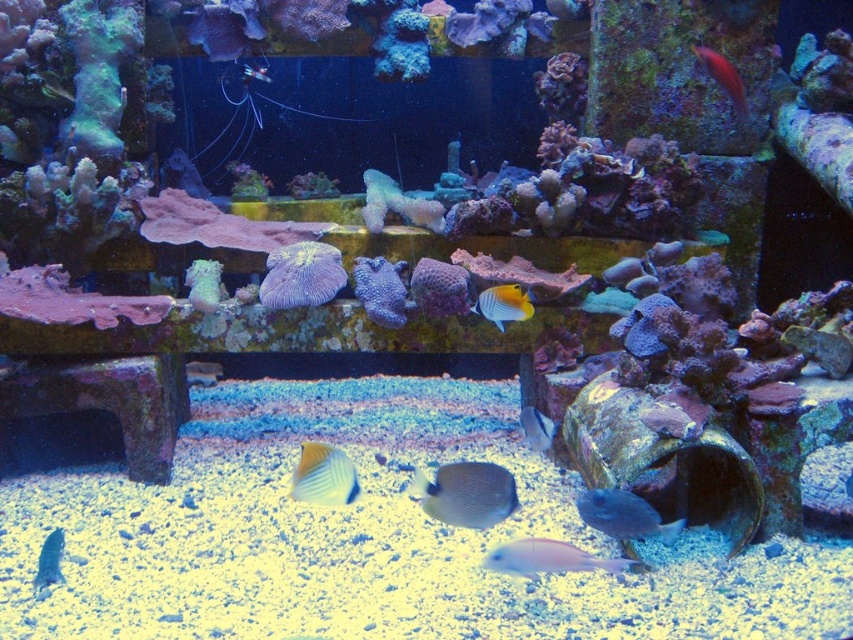
Can you confirm if white glossy fish at lower center is shorter than yellow-orange translucent butterflyfish at center?

Correct, white glossy fish at lower center is not as tall as yellow-orange translucent butterflyfish at center.

Locate an element on the screen. This screenshot has height=640, width=853. white glossy fish at lower center is located at coordinates (546, 557).

Which is in front, point (546, 556) or point (482, 292)?

Positioned in front is point (546, 556).

Where is `white glossy fish at lower center`? white glossy fish at lower center is located at coordinates (546, 557).

Does blue glossy fish at lower center appear on the right side of blue glossy fish at lower left?

Yes, blue glossy fish at lower center is to the right of blue glossy fish at lower left.

Between blue glossy fish at lower center and blue glossy fish at lower left, which one appears on the left side from the viewer's perspective?

From the viewer's perspective, blue glossy fish at lower left appears more on the left side.

Is point (604, 513) in front of point (61, 570)?

Yes, it is.

Where is `blue glossy fish at lower center`? Image resolution: width=853 pixels, height=640 pixels. blue glossy fish at lower center is located at coordinates (624, 515).

Is purple coral at center to the right of matte silver fish at center from the viewer's perspective?

No, purple coral at center is not to the right of matte silver fish at center.

Does purple coral at center appear under matte silver fish at center?

No, purple coral at center is not below matte silver fish at center.

Is point (381, 314) closer to camera compared to point (532, 435)?

No, it is not.

Identify the location of purple coral at center. The height and width of the screenshot is (640, 853). (380, 289).